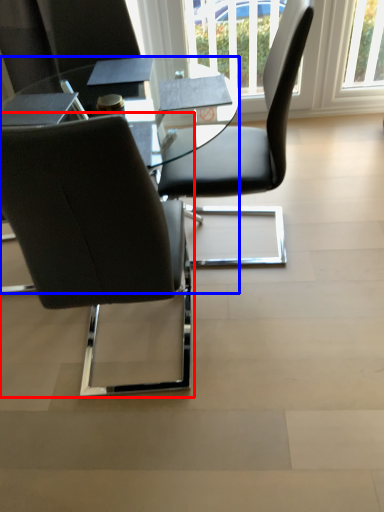
Question: Which of the following is the farthest to the observer, chair (highlighted by a red box) or table (highlighted by a blue box)?

Choices:
 (A) chair
 (B) table

Answer: (B)